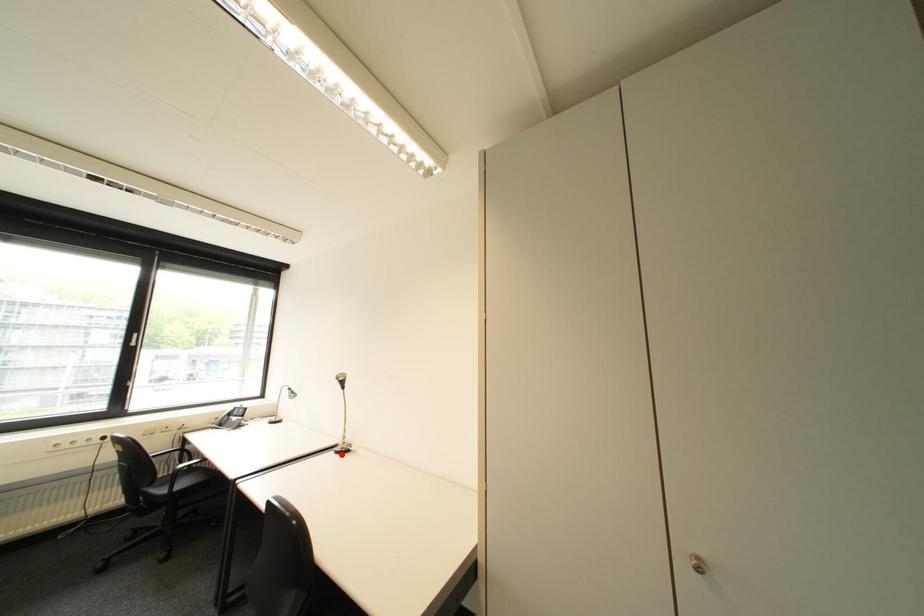
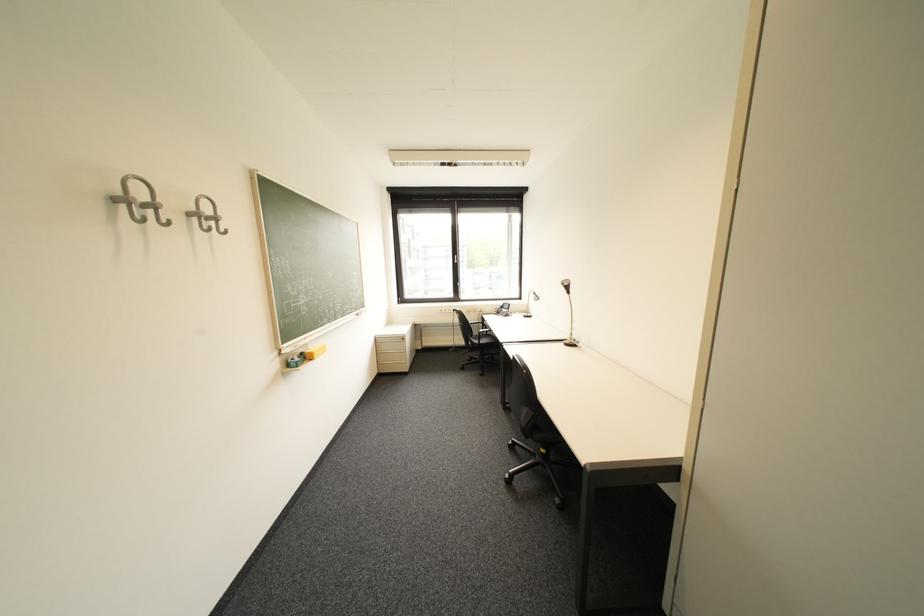
Question: I am providing you with two images of the same scene from different viewpoints. Image1 has a red point marked. In image2, the corresponding 3D location appears at what relative position? Reply with the corresponding letter.

Choices:
 (A) Closer
 (B) Farther

Answer: (A)